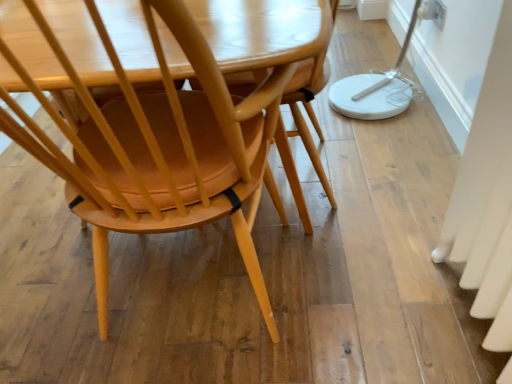
The height and width of the screenshot is (384, 512). What do you see at coordinates (153, 137) in the screenshot?
I see `matte wood chair at center` at bounding box center [153, 137].

I want to click on matte wood chair at center, so coord(153,137).

Where is `matte wood chair at center`? matte wood chair at center is located at coordinates (153, 137).